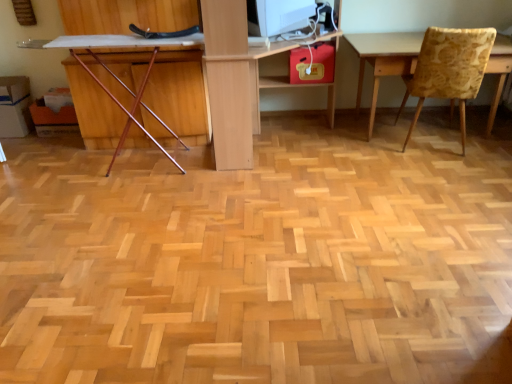
Question: From the image's perspective, would you say white glossy computer monitor at upper center is shown under yellow floral fabric chair at right, the 1th chair positioned from the right?

Choices:
 (A) no
 (B) yes

Answer: (A)

Question: Is white glossy computer monitor at upper center positioned beyond the bounds of yellow floral fabric chair at right, the 1th chair positioned from the right?

Choices:
 (A) no
 (B) yes

Answer: (B)

Question: Is white glossy computer monitor at upper center facing away from yellow floral fabric chair at right, the 1th chair positioned from the right?

Choices:
 (A) no
 (B) yes

Answer: (A)

Question: Is white glossy computer monitor at upper center at the right side of yellow floral fabric chair at right, placed as the second chair when sorted from left to right?

Choices:
 (A) yes
 (B) no

Answer: (B)

Question: Is white glossy computer monitor at upper center positioned before yellow floral fabric chair at right, placed as the second chair when sorted from left to right?

Choices:
 (A) yes
 (B) no

Answer: (B)

Question: Is white glossy computer monitor at upper center wider than yellow floral fabric chair at right, placed as the second chair when sorted from left to right?

Choices:
 (A) no
 (B) yes

Answer: (A)

Question: Can we say yellow floral fabric chair at right, the 1th chair positioned from the right, lies outside light wood computer desk at center?

Choices:
 (A) no
 (B) yes

Answer: (B)

Question: Is yellow floral fabric chair at right, the 1th chair positioned from the right, closer to camera compared to light wood computer desk at center?

Choices:
 (A) no
 (B) yes

Answer: (A)

Question: Is yellow floral fabric chair at right, placed as the second chair when sorted from left to right, shorter than light wood computer desk at center?

Choices:
 (A) no
 (B) yes

Answer: (B)

Question: Can you confirm if yellow floral fabric chair at right, placed as the second chair when sorted from left to right, is taller than light wood computer desk at center?

Choices:
 (A) no
 (B) yes

Answer: (A)

Question: Is yellow floral fabric chair at right, the 1th chair positioned from the right, bigger than light wood computer desk at center?

Choices:
 (A) yes
 (B) no

Answer: (B)

Question: Is yellow floral fabric chair at right, the 1th chair positioned from the right, further to the viewer compared to light wood computer desk at center?

Choices:
 (A) yes
 (B) no

Answer: (A)

Question: Is white glossy computer monitor at upper center surrounded by wooden chair at left, placed as the 2th chair when sorted from right to left?

Choices:
 (A) no
 (B) yes

Answer: (A)